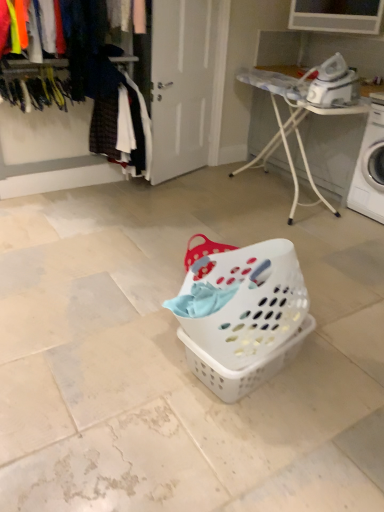
Question: Based on their positions, is velvet-like fabric at upper left located to the left or right of white plastic iron at upper right?

Choices:
 (A) left
 (B) right

Answer: (A)

Question: Considering the positions of velvet-like fabric at upper left and white plastic iron at upper right in the image, is velvet-like fabric at upper left taller or shorter than white plastic iron at upper right?

Choices:
 (A) short
 (B) tall

Answer: (A)

Question: Based on their relative distances, which object is farther from the plaid fabric shirt at left?

Choices:
 (A) velvet-like fabric at upper left
 (B) white plastic washing machine at right
 (C) white plastic ironing board at upper right
 (D) matte plastic clothes at upper left
 (E) white plastic laundry basket at center

Answer: (E)

Question: Which is farther from the white plastic ironing board at upper right?

Choices:
 (A) velvet-like fabric at upper left
 (B) white plastic washing machine at right
 (C) white plastic laundry basket at center
 (D) matte plastic clothes at upper left
 (E) plaid fabric shirt at left

Answer: (A)